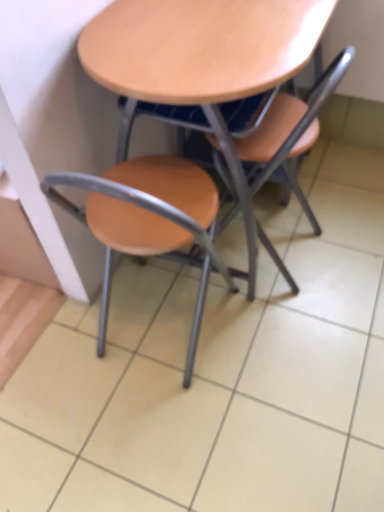
What is the approximate height of matte wood chair at center, acting as the first chair starting from the right?

matte wood chair at center, acting as the first chair starting from the right, is 30.18 inches tall.

Find the location of a particular element. matte wood chair at center, which is the second chair in left-to-right order is located at coordinates (288, 134).

From a real-world perspective, starting from the wooden at center, which chair is the 2nd one below it? Please provide its 2D coordinates.

[(148, 220)]

Considering the sizes of objects matte wood chair at center, marked as the 2th chair in a right-to-left arrangement, and wooden at center in the image provided, who is smaller, matte wood chair at center, marked as the 2th chair in a right-to-left arrangement, or wooden at center?

matte wood chair at center, marked as the 2th chair in a right-to-left arrangement.

Does matte wood chair at center, the 1th chair when ordered from left to right, come behind matte wood chair at center, which is the second chair in left-to-right order?

No.

Is matte wood chair at center, the 1th chair when ordered from left to right, to the right of matte wood chair at center, acting as the first chair starting from the right, from the viewer's perspective?

No, matte wood chair at center, the 1th chair when ordered from left to right, is not to the right of matte wood chair at center, acting as the first chair starting from the right.

Is matte wood chair at center, marked as the 2th chair in a right-to-left arrangement, completely or partially outside of matte wood chair at center, acting as the first chair starting from the right?

matte wood chair at center, marked as the 2th chair in a right-to-left arrangement, lies outside matte wood chair at center, acting as the first chair starting from the right,'s area.

Can you confirm if matte wood chair at center, the 1th chair when ordered from left to right, is thinner than matte wood chair at center, which is the second chair in left-to-right order?

No.

Do you think matte wood chair at center, which is the second chair in left-to-right order, is within matte wood chair at center, marked as the 2th chair in a right-to-left arrangement, or outside of it?

matte wood chair at center, which is the second chair in left-to-right order, is not enclosed by matte wood chair at center, marked as the 2th chair in a right-to-left arrangement.

Which of these two, matte wood chair at center, acting as the first chair starting from the right, or matte wood chair at center, marked as the 2th chair in a right-to-left arrangement, is wider?

matte wood chair at center, marked as the 2th chair in a right-to-left arrangement.

Is matte wood chair at center, which is the second chair in left-to-right order, oriented away from matte wood chair at center, marked as the 2th chair in a right-to-left arrangement?

No, matte wood chair at center, which is the second chair in left-to-right order,'s orientation is not away from matte wood chair at center, marked as the 2th chair in a right-to-left arrangement.

From the image's perspective, is wooden at center positioned above or below matte wood chair at center, marked as the 2th chair in a right-to-left arrangement?

Clearly, from the image's perspective, wooden at center is above matte wood chair at center, marked as the 2th chair in a right-to-left arrangement.

Is wooden at center turned away from matte wood chair at center, the 1th chair when ordered from left to right?

wooden at center does not have its back to matte wood chair at center, the 1th chair when ordered from left to right.

From the picture: Which of these two, wooden at center or matte wood chair at center, marked as the 2th chair in a right-to-left arrangement, stands taller?

With more height is wooden at center.

Which object is positioned more to the right, wooden at center or matte wood chair at center, marked as the 2th chair in a right-to-left arrangement?

wooden at center.

Is matte wood chair at center, which is the second chair in left-to-right order, inside wooden at center?

That's correct, matte wood chair at center, which is the second chair in left-to-right order, is inside wooden at center.

Measure the distance from wooden at center to matte wood chair at center, acting as the first chair starting from the right.

wooden at center and matte wood chair at center, acting as the first chair starting from the right, are 6.87 inches apart from each other.

Is wooden at center in front of or behind matte wood chair at center, acting as the first chair starting from the right, in the image?

wooden at center is positioned closer to the viewer than matte wood chair at center, acting as the first chair starting from the right.

Does wooden at center have a lesser height compared to matte wood chair at center, which is the second chair in left-to-right order?

In fact, wooden at center may be taller than matte wood chair at center, which is the second chair in left-to-right order.

Looking at the image, does matte wood chair at center, which is the second chair in left-to-right order, seem bigger or smaller compared to wooden at center?

Clearly, matte wood chair at center, which is the second chair in left-to-right order, is smaller in size than wooden at center.

Between point (256, 179) and point (175, 48), which one is positioned behind?

Positioned behind is point (256, 179).

Are matte wood chair at center, which is the second chair in left-to-right order, and wooden at center beside each other?

No, matte wood chair at center, which is the second chair in left-to-right order, is not in contact with wooden at center.

From a real-world perspective, is matte wood chair at center, which is the second chair in left-to-right order, on top of wooden at center?

No, from a real-world perspective, matte wood chair at center, which is the second chair in left-to-right order, is not on top of wooden at center.

Identify the location of table that is on the right side of matte wood chair at center, marked as the 2th chair in a right-to-left arrangement. The height and width of the screenshot is (512, 384). (200, 47).

Locate an element on the screen. The width and height of the screenshot is (384, 512). chair behind the matte wood chair at center, marked as the 2th chair in a right-to-left arrangement is located at coordinates (288, 134).

In the scene shown: Which object lies further to the anchor point matte wood chair at center, which is the second chair in left-to-right order, wooden at center or matte wood chair at center, the 1th chair when ordered from left to right?

matte wood chair at center, the 1th chair when ordered from left to right.

Looking at the image, which one is located closer to matte wood chair at center, marked as the 2th chair in a right-to-left arrangement, matte wood chair at center, acting as the first chair starting from the right, or wooden at center?

matte wood chair at center, acting as the first chair starting from the right.

Looking at the image, which one is located closer to wooden at center, matte wood chair at center, acting as the first chair starting from the right, or matte wood chair at center, the 1th chair when ordered from left to right?

Among the two, matte wood chair at center, acting as the first chair starting from the right, is located nearer to wooden at center.

Estimate the real-world distances between objects in this image. Which object is closer to matte wood chair at center, marked as the 2th chair in a right-to-left arrangement, wooden at center or matte wood chair at center, acting as the first chair starting from the right?

The object closer to matte wood chair at center, marked as the 2th chair in a right-to-left arrangement, is matte wood chair at center, acting as the first chair starting from the right.

From the image, which object appears to be farther from wooden at center, matte wood chair at center, marked as the 2th chair in a right-to-left arrangement, or matte wood chair at center, acting as the first chair starting from the right?

matte wood chair at center, marked as the 2th chair in a right-to-left arrangement, lies further to wooden at center than the other object.

In the scene shown: Looking at the image, which one is located further to matte wood chair at center, acting as the first chair starting from the right, matte wood chair at center, the 1th chair when ordered from left to right, or wooden at center?

matte wood chair at center, the 1th chair when ordered from left to right.

At what (x,y) coordinates should I click in order to perform the action: click on chair between wooden at center and matte wood chair at center, the 1th chair when ordered from left to right, in the vertical direction. Please return your answer as a coordinate pair (x, y). The image size is (384, 512). Looking at the image, I should click on click(x=288, y=134).